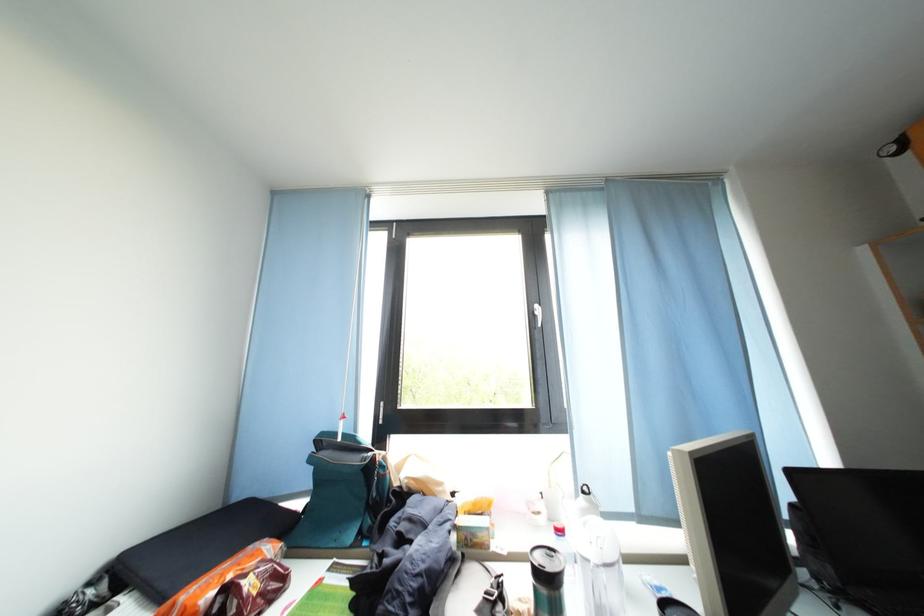
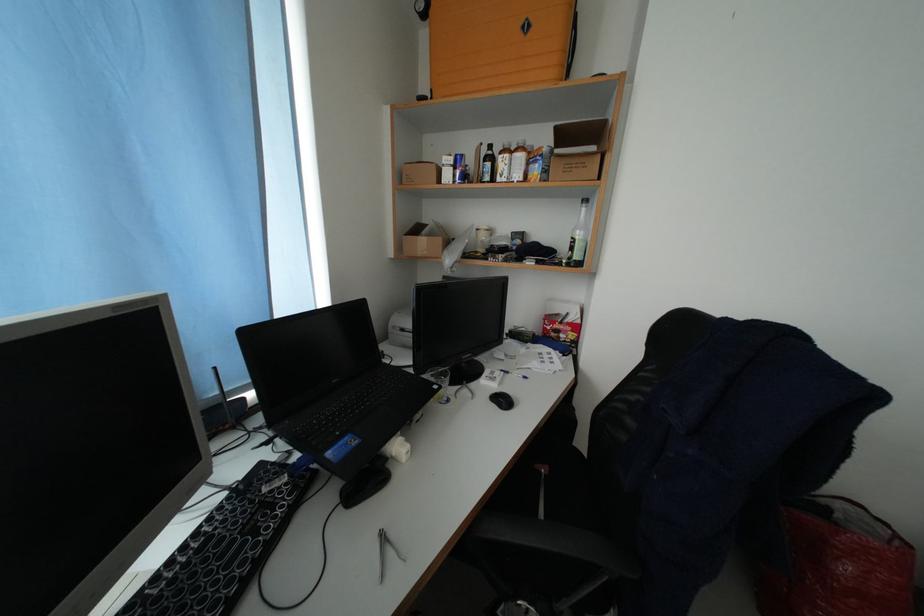
The images are taken continuously from a first-person perspective. In which direction is your viewpoint rotating?

The camera's rotation is toward right-down.